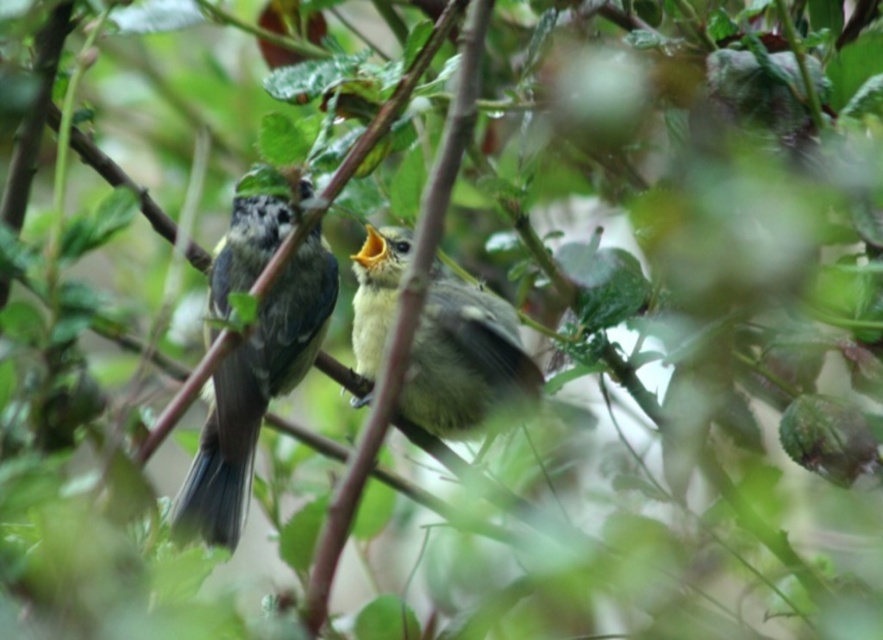
You are a researcher observing birds in a forest. You notice a point at coordinates (x=254, y=394). Which bird is located at that point?

The point at coordinates (x=254, y=394) corresponds to the speckled gray bird at center.